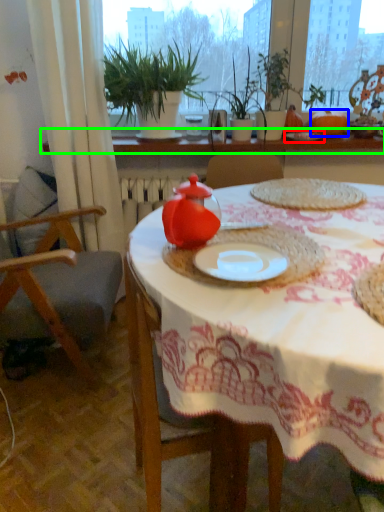
Question: Which is farther away from tableware (highlighted by a red box)? pumpkin (highlighted by a blue box) or window sill (highlighted by a green box)?

Choices:
 (A) pumpkin
 (B) window sill

Answer: (B)